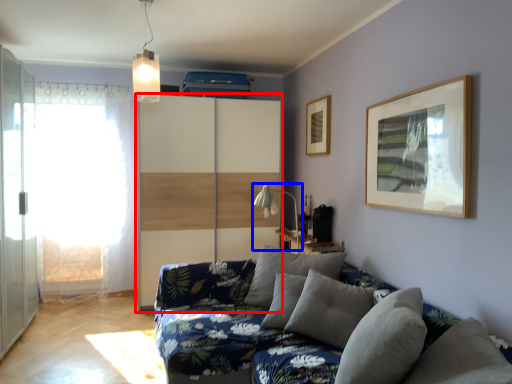
Question: Which of the following is the farthest to the observer, dresser (highlighted by a red box) or table lamp (highlighted by a blue box)?

Choices:
 (A) dresser
 (B) table lamp

Answer: (A)